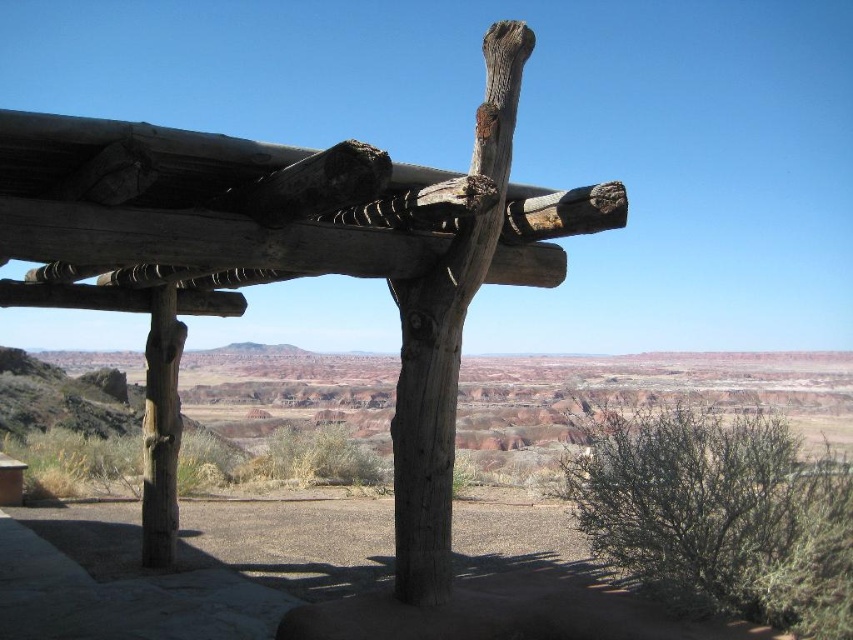
Question: From the image, what is the correct spatial relationship of natural wood post at center in relation to natural wood pole at center?

Choices:
 (A) left
 (B) right

Answer: (A)

Question: Which of the following is the farthest from the observer?

Choices:
 (A) natural wood pole at center
 (B) natural wood post at center

Answer: (A)

Question: Which point is farther to the camera?

Choices:
 (A) natural wood post at center
 (B) natural wood pole at center

Answer: (B)

Question: Observing the image, what is the correct spatial positioning of natural wood post at center in reference to natural wood pole at center?

Choices:
 (A) left
 (B) right

Answer: (A)

Question: In this image, where is natural wood post at center located relative to natural wood pole at center?

Choices:
 (A) left
 (B) right

Answer: (A)